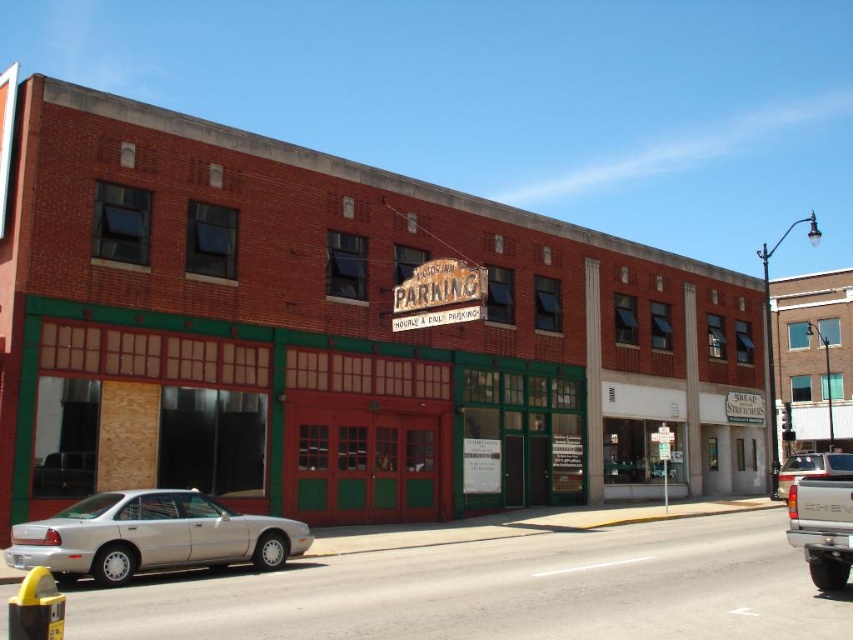
What is the spatial relationship between the silver metallic sedan at lower left and the white matte truck at lower right in the scene?

The silver metallic sedan at lower left is positioned on the left side of the white matte truck at lower right.

Looking at this image, you are a delivery driver who needs to park your truck in the parking lot next to the PATIO INN PARKING sign. The parking spot you want to take can only accommodate vehicles that are shorter than the white matte truck at lower right. Can your silver metallic truck at lower right fit in that spot?

The silver metallic truck at lower right has a lesser height compared to the white matte truck at lower right. Since the parking spot requires vehicles to be shorter than the white matte truck at lower right, the silver metallic truck at lower right can fit in that spot.

What is the relationship between the widths of the silver metallic truck at lower right and the white matte truck at lower right?

The silver metallic truck at lower right is narrower than the white matte truck at lower right.